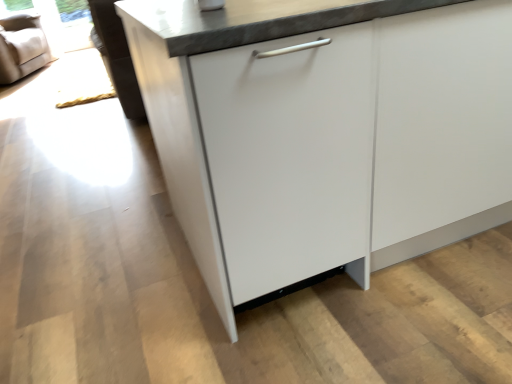
Question: Should I look upward or downward to see white glossy cabinet at center?

Choices:
 (A) up
 (B) down

Answer: (A)

Question: Is transparent glass window screen at upper left closer to the viewer compared to beige fabric armchair at upper left?

Choices:
 (A) yes
 (B) no

Answer: (B)

Question: From a real-world perspective, is transparent glass window screen at upper left under beige fabric armchair at upper left?

Choices:
 (A) no
 (B) yes

Answer: (B)

Question: Is transparent glass window screen at upper left smaller than beige fabric armchair at upper left?

Choices:
 (A) no
 (B) yes

Answer: (B)

Question: Can you confirm if transparent glass window screen at upper left is positioned to the right of beige fabric armchair at upper left?

Choices:
 (A) no
 (B) yes

Answer: (B)

Question: Is transparent glass window screen at upper left next to beige fabric armchair at upper left?

Choices:
 (A) no
 (B) yes

Answer: (A)

Question: Does transparent glass window screen at upper left have a lesser height compared to beige fabric armchair at upper left?

Choices:
 (A) yes
 (B) no

Answer: (A)

Question: Considering the relative positions of beige fabric armchair at upper left and white glossy cabinet at center in the image provided, is beige fabric armchair at upper left to the left of white glossy cabinet at center from the viewer's perspective?

Choices:
 (A) yes
 (B) no

Answer: (A)

Question: Is beige fabric armchair at upper left not close to white glossy cabinet at center?

Choices:
 (A) yes
 (B) no

Answer: (A)

Question: From the image's perspective, is beige fabric armchair at upper left located above white glossy cabinet at center?

Choices:
 (A) no
 (B) yes

Answer: (B)

Question: From a real-world perspective, is beige fabric armchair at upper left over white glossy cabinet at center?

Choices:
 (A) no
 (B) yes

Answer: (A)

Question: From the image's perspective, would you say beige fabric armchair at upper left is shown under white glossy cabinet at center?

Choices:
 (A) yes
 (B) no

Answer: (B)

Question: Is beige fabric armchair at upper left outside of white glossy cabinet at center?

Choices:
 (A) no
 (B) yes

Answer: (B)

Question: Considering the relative sizes of beige fabric armchair at upper left and transparent glass window screen at upper left in the image provided, is beige fabric armchair at upper left smaller than transparent glass window screen at upper left?

Choices:
 (A) no
 (B) yes

Answer: (A)